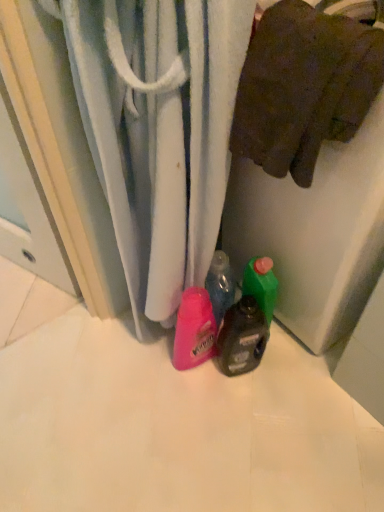
Question: Is brown cotton towel at upper right positioned with its back to translucent plastic bottle at center?

Choices:
 (A) no
 (B) yes

Answer: (A)

Question: From the image's perspective, is brown cotton towel at upper right located beneath translucent plastic bottle at center?

Choices:
 (A) yes
 (B) no

Answer: (B)

Question: Are brown cotton towel at upper right and translucent plastic bottle at center located far from each other?

Choices:
 (A) no
 (B) yes

Answer: (A)

Question: Does brown cotton towel at upper right have a greater width compared to translucent plastic bottle at center?

Choices:
 (A) no
 (B) yes

Answer: (B)

Question: From the image's perspective, does brown cotton towel at upper right appear higher than translucent plastic bottle at center?

Choices:
 (A) no
 (B) yes

Answer: (B)

Question: Considering the positions of white textured towel at center and translucent plastic bottle at center in the image, is white textured towel at center bigger or smaller than translucent plastic bottle at center?

Choices:
 (A) small
 (B) big

Answer: (B)

Question: Considering their positions, is white textured towel at center located in front of or behind translucent plastic bottle at center?

Choices:
 (A) front
 (B) behind

Answer: (A)

Question: Does point (216, 112) appear closer or farther from the camera than point (226, 334)?

Choices:
 (A) farther
 (B) closer

Answer: (B)

Question: From the image's perspective, is white textured towel at center above or below translucent plastic bottle at center?

Choices:
 (A) below
 (B) above

Answer: (B)

Question: Looking at the image, does brown cotton towel at upper right seem bigger or smaller compared to white textured towel at center?

Choices:
 (A) small
 (B) big

Answer: (A)

Question: Considering their positions, is brown cotton towel at upper right located in front of or behind white textured towel at center?

Choices:
 (A) behind
 (B) front

Answer: (A)

Question: In terms of height, does brown cotton towel at upper right look taller or shorter compared to white textured towel at center?

Choices:
 (A) short
 (B) tall

Answer: (A)

Question: Is brown cotton towel at upper right spatially inside white textured towel at center, or outside of it?

Choices:
 (A) inside
 (B) outside

Answer: (B)

Question: In terms of width, does translucent plastic bottle at center look wider or thinner when compared to brown cotton towel at upper right?

Choices:
 (A) thin
 (B) wide

Answer: (A)

Question: Considering the positions of point [266, 340] and point [350, 46], is point [266, 340] closer or farther from the camera than point [350, 46]?

Choices:
 (A) closer
 (B) farther

Answer: (B)